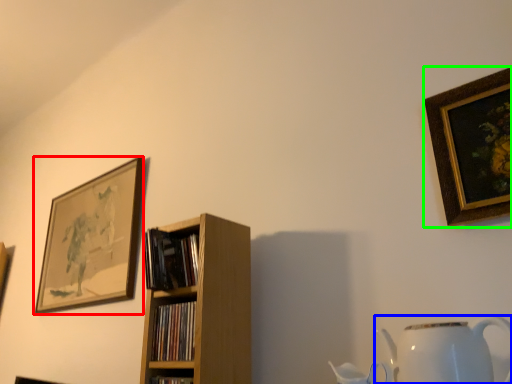
Question: Which is farther away from picture frame (highlighted by a red box)? jug (highlighted by a blue box) or picture frame (highlighted by a green box)?

Choices:
 (A) jug
 (B) picture frame

Answer: (B)